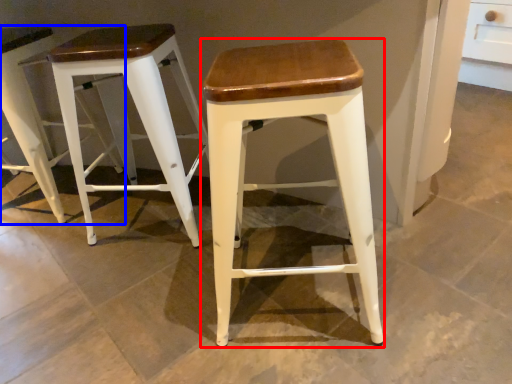
Question: Among these objects, which one is farthest to the camera, stool (highlighted by a red box) or stool (highlighted by a blue box)?

Choices:
 (A) stool
 (B) stool

Answer: (B)